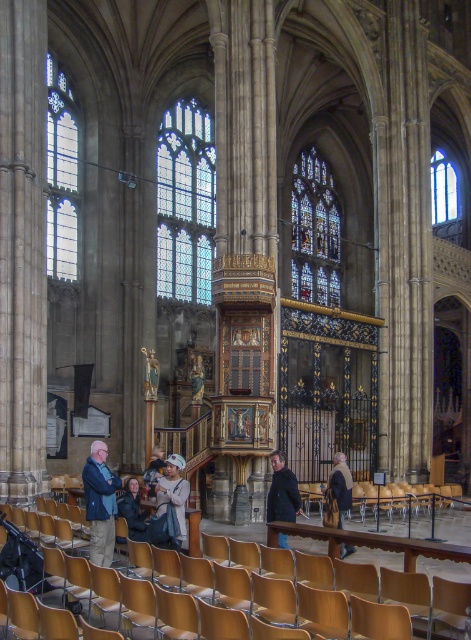
You are standing in the cathedral and want to determine the relative positions of two points marked in the image. Which of the two points, point (x=290, y=468) or point (x=127, y=513), is closer to you?

Point (x=290, y=468) is closer to you because it is further to the viewer than point (x=127, y=513).

You are a visitor in the cathedral and you see the dark brown leather coat at center and the dark blue fabric jacket at lower center. Which one is larger in size?

The dark brown leather coat at center is bigger than the dark blue fabric jacket at lower center.